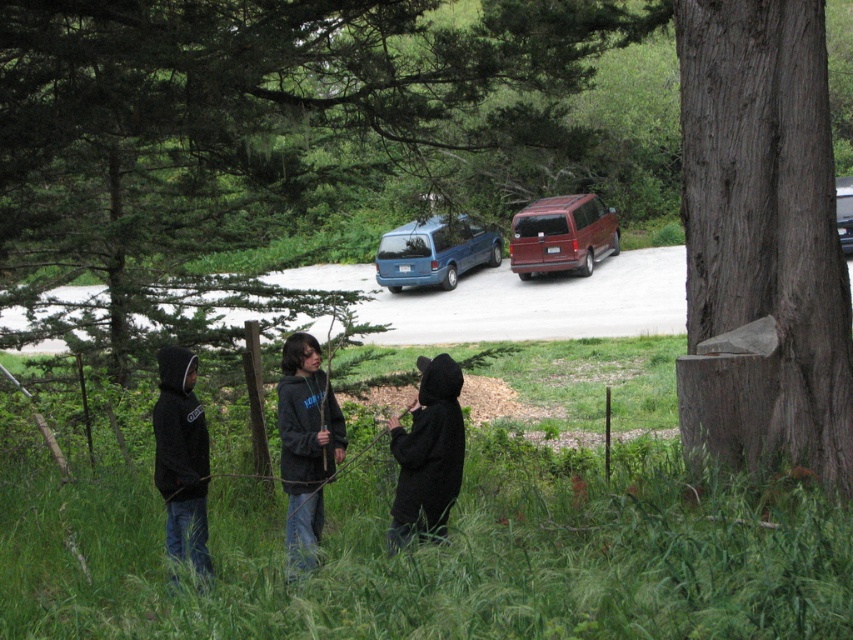
Question: Can you confirm if smooth bark tree at center is positioned above black fuzzy jacket at center?

Choices:
 (A) no
 (B) yes

Answer: (B)

Question: Is smooth bark tree at center thinner than brown rough wooden post at center?

Choices:
 (A) yes
 (B) no

Answer: (B)

Question: Estimate the real-world distances between objects in this image. Which object is closer to the metallic maroon van at center right?

Choices:
 (A) smooth bark tree at center
 (B) black fuzzy jacket at center

Answer: (A)

Question: Which of the following is the farthest from the observer?

Choices:
 (A) black hoodie at left
 (B) black hoodie at center
 (C) black fuzzy jacket at center

Answer: (A)

Question: Which object is closer to the camera taking this photo?

Choices:
 (A) gray rough bark tree trunk at right
 (B) black hoodie at center
 (C) brown rough wooden post at center

Answer: (A)

Question: Is gray rough bark tree trunk at right wider than black hoodie at center?

Choices:
 (A) yes
 (B) no

Answer: (A)